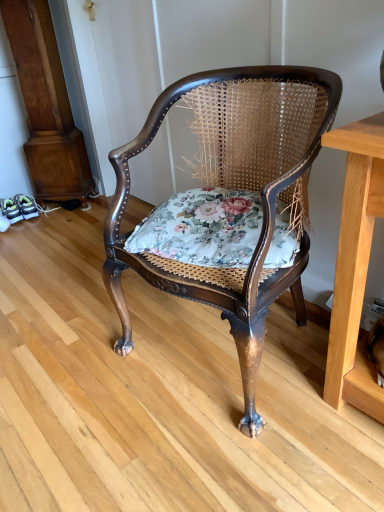
This screenshot has height=512, width=384. Identify the location of polished wood chair at center. click(x=233, y=188).

Describe the element at coordinates (233, 188) in the screenshot. I see `polished wood chair at center` at that location.

What do you see at coordinates (202, 228) in the screenshot? This screenshot has width=384, height=512. I see `floral fabric cushion at center` at bounding box center [202, 228].

In order to face floral fabric cushion at center, should I rotate leftwards or rightwards?

To align with it, rotate right about 3.494°.

The width and height of the screenshot is (384, 512). Identify the location of floral fabric cushion at center. (202, 228).

You are a GUI agent. You are given a task and a screenshot of the screen. Output one action in this format:
    pyautogui.click(x=<x>, y=<y>)
    Task: Click on the polished wood chair at center
    The image size is (384, 512).
    Given the screenshot: What is the action you would take?
    pyautogui.click(x=233, y=188)

Can you confirm if polished wood chair at center is positioned to the right of floral fabric cushion at center?

Correct, you'll find polished wood chair at center to the right of floral fabric cushion at center.

Relative to floral fabric cushion at center, is polished wood chair at center in front or behind?

Visually, polished wood chair at center is located in front of floral fabric cushion at center.

Is point (300, 175) closer to viewer compared to point (165, 224)?

Yes, it is.

From the image's perspective, which object appears higher, polished wood chair at center or floral fabric cushion at center?

From the image's view, floral fabric cushion at center is above.

From a real-world perspective, is polished wood chair at center above or below floral fabric cushion at center?

polished wood chair at center is situated lower than floral fabric cushion at center in the real world.

Which object is wider, polished wood chair at center or floral fabric cushion at center?

polished wood chair at center.

Looking at this image, can you confirm if polished wood chair at center is taller than floral fabric cushion at center?

Correct, polished wood chair at center is much taller as floral fabric cushion at center.

Looking at the image, does polished wood chair at center seem bigger or smaller compared to floral fabric cushion at center?

In the image, polished wood chair at center appears to be larger than floral fabric cushion at center.

Is polished wood chair at center completely or partially outside of floral fabric cushion at center?

Yes, polished wood chair at center is not within floral fabric cushion at center.

Is the surface of polished wood chair at center in direct contact with floral fabric cushion at center?

There is a gap between polished wood chair at center and floral fabric cushion at center.

Could you tell me if polished wood chair at center is facing floral fabric cushion at center?

Yes, polished wood chair at center is turned towards floral fabric cushion at center.

At what (x,y) coordinates should I click in order to perform the action: click on chair in front of the floral fabric cushion at center. Please return your answer as a coordinate pair (x, y). Image resolution: width=384 pixels, height=512 pixels. Looking at the image, I should click on (233, 188).

Can you confirm if floral fabric cushion at center is positioned to the right of polished wood chair at center?

Incorrect, floral fabric cushion at center is not on the right side of polished wood chair at center.

From the picture: Does floral fabric cushion at center lie in front of polished wood chair at center?

No, floral fabric cushion at center is further to the viewer.

Considering the positions of point (160, 220) and point (328, 123), is point (160, 220) closer or farther from the camera than point (328, 123)?

Point (160, 220) is farther from the camera than point (328, 123).

From the image's perspective, is floral fabric cushion at center positioned above or below polished wood chair at center?

Based on their image positions, floral fabric cushion at center is located above polished wood chair at center.

From a real-world perspective, who is located higher, floral fabric cushion at center or polished wood chair at center?

From a 3D spatial view, floral fabric cushion at center is above.

Which of these two, floral fabric cushion at center or polished wood chair at center, is thinner?

With smaller width is floral fabric cushion at center.

Who is taller, floral fabric cushion at center or polished wood chair at center?

Standing taller between the two is polished wood chair at center.

Does floral fabric cushion at center have a larger size compared to polished wood chair at center?

No.

Is polished wood chair at center located within floral fabric cushion at center?

No, polished wood chair at center is not inside floral fabric cushion at center.

Is floral fabric cushion at center with polished wood chair at center?

No, floral fabric cushion at center is not making contact with polished wood chair at center.

Is floral fabric cushion at center positioned with its back to polished wood chair at center?

That's right, floral fabric cushion at center is facing away from polished wood chair at center.

At what (x,y) coordinates should I click in order to perform the action: click on blanket that appears above the polished wood chair at center (from a real-world perspective). Please return your answer as a coordinate pair (x, y). The image size is (384, 512). Looking at the image, I should click on (202, 228).

Where is `chair below the floral fabric cushion at center (from a real-world perspective)`? The width and height of the screenshot is (384, 512). chair below the floral fabric cushion at center (from a real-world perspective) is located at coordinates (233, 188).

Identify the location of chair to the right of floral fabric cushion at center. (233, 188).